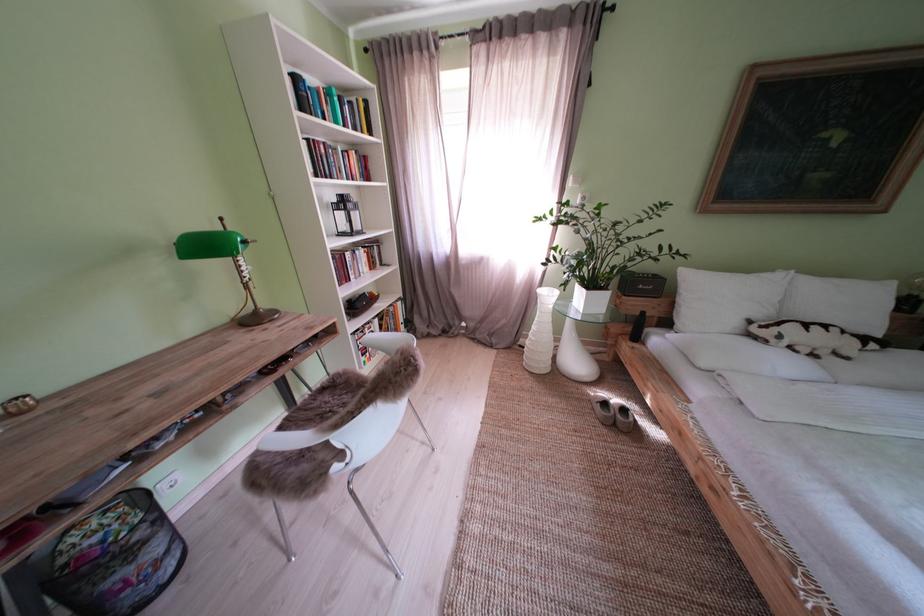
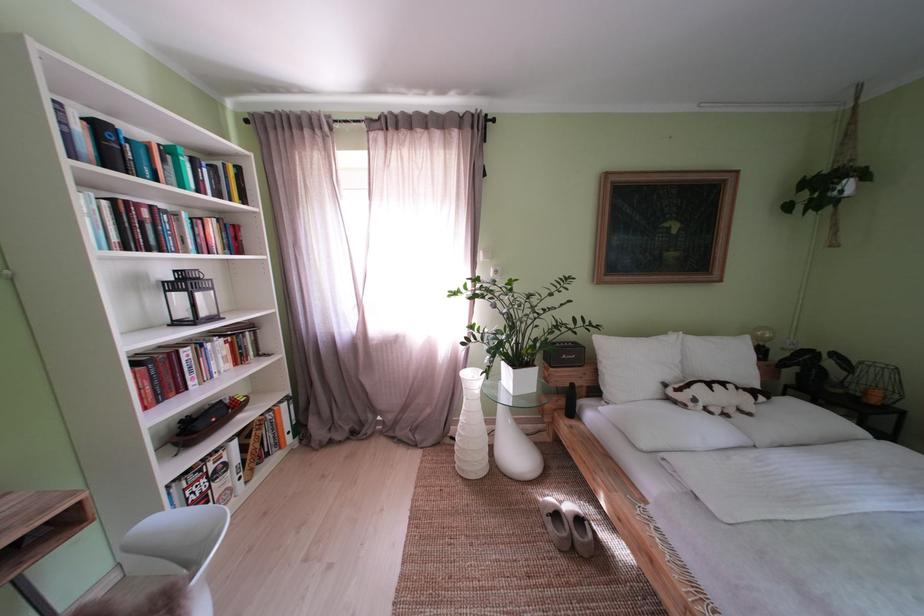
Where in the second image is the point corresponding to pixel 600 400 from the first image?

(546, 506)